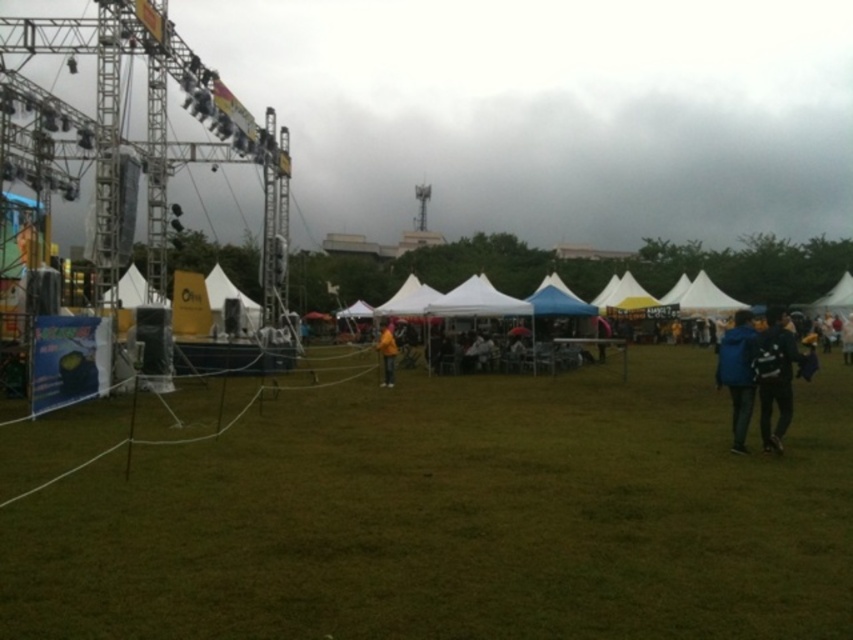
You are organizing an outdoor event and need to place a 10 meter long banner between the blue fabric jacket at right and the light blue fabric tent at center. Is there enough space to place the banner without overlapping either object?

The distance between the blue fabric jacket at right and the light blue fabric tent at center is 11.59 meters. Since the banner is 10 meters long, there is enough space to place it without overlapping either object.

You are a photographer standing at the edge of the green grass at center. You want to take a photo of the yellow matte jacket at center so that both the grass and the jacket are visible. Which object should be placed closer to the camera to ensure both are in focus?

The green grass at center has a lesser height compared to yellow matte jacket at center. To ensure both are in focus, place the yellow matte jacket at center closer to the camera since it is taller and needs to be within the depth of field range of the green grass at center.

You are standing at the edge of the grassy field looking towards the stage. You see a blue fabric backpack at right and a blue fabric jacket at right. Which one is closer to you?

The blue fabric backpack at right is closer to you because it is in front of the blue fabric jacket at right.